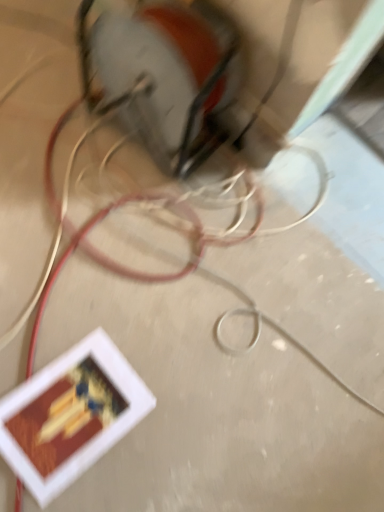
At what (x,y) coordinates should I click in order to perform the action: click on matte red wire at lower left. Please return your answer as a coordinate pair (x, y). Looking at the image, I should click on (121, 264).

What do you see at coordinates (121, 264) in the screenshot? The height and width of the screenshot is (512, 384). I see `matte red wire at lower left` at bounding box center [121, 264].

What is the approximate width of matte red wire at lower left?

The width of matte red wire at lower left is 5.69 feet.

At what (x,y) coordinates should I click in order to perform the action: click on metallic silver power plugs and sockets at upper center. Please return your answer as a coordinate pair (x, y). The height and width of the screenshot is (512, 384). Looking at the image, I should click on (168, 76).

What do you see at coordinates (168, 76) in the screenshot? I see `metallic silver power plugs and sockets at upper center` at bounding box center [168, 76].

This screenshot has width=384, height=512. I want to click on matte red wire at lower left, so click(x=121, y=264).

Between matte red wire at lower left and metallic silver power plugs and sockets at upper center, which one appears on the left side from the viewer's perspective?

metallic silver power plugs and sockets at upper center.

Based on the photo, is the position of matte red wire at lower left more distant than that of metallic silver power plugs and sockets at upper center?

No.

Does point (144, 199) appear closer or farther from the camera than point (178, 119)?

Clearly, point (144, 199) is more distant from the camera than point (178, 119).

From the image's perspective, which is below, matte red wire at lower left or metallic silver power plugs and sockets at upper center?

matte red wire at lower left appears lower in the image.

From a real-world perspective, which object stands above the other?

From a 3D spatial view, metallic silver power plugs and sockets at upper center is above.

Between matte red wire at lower left and metallic silver power plugs and sockets at upper center, which one has smaller width?

Thinner between the two is metallic silver power plugs and sockets at upper center.

Does matte red wire at lower left have a lesser height compared to metallic silver power plugs and sockets at upper center?

Correct, matte red wire at lower left is not as tall as metallic silver power plugs and sockets at upper center.

Who is bigger, matte red wire at lower left or metallic silver power plugs and sockets at upper center?

matte red wire at lower left.

Is matte red wire at lower left located outside metallic silver power plugs and sockets at upper center?

Indeed, matte red wire at lower left is completely outside metallic silver power plugs and sockets at upper center.

Is matte red wire at lower left placed right next to metallic silver power plugs and sockets at upper center?

No, matte red wire at lower left is not in contact with metallic silver power plugs and sockets at upper center.

Looking at this image, is matte red wire at lower left turned away from metallic silver power plugs and sockets at upper center?

No, matte red wire at lower left's orientation is not away from metallic silver power plugs and sockets at upper center.

The width and height of the screenshot is (384, 512). I want to click on power plugs and sockets that is above the matte red wire at lower left (from the image's perspective), so click(x=168, y=76).

Is metallic silver power plugs and sockets at upper center to the left or to the right of matte red wire at lower left in the image?

metallic silver power plugs and sockets at upper center is positioned on matte red wire at lower left's left side.

Is metallic silver power plugs and sockets at upper center positioned in front of matte red wire at lower left?

No, metallic silver power plugs and sockets at upper center is further to the viewer.

Which is further, (205, 37) or (36, 332)?

Positioned behind is point (36, 332).

From the image's perspective, between metallic silver power plugs and sockets at upper center and matte red wire at lower left, who is located below?

From the image's view, matte red wire at lower left is below.

From a real-world perspective, which is physically above, metallic silver power plugs and sockets at upper center or matte red wire at lower left?

metallic silver power plugs and sockets at upper center is physically above.

Is metallic silver power plugs and sockets at upper center thinner than matte red wire at lower left?

Correct, the width of metallic silver power plugs and sockets at upper center is less than that of matte red wire at lower left.

Considering the relative sizes of metallic silver power plugs and sockets at upper center and matte red wire at lower left in the image provided, is metallic silver power plugs and sockets at upper center shorter than matte red wire at lower left?

In fact, metallic silver power plugs and sockets at upper center may be taller than matte red wire at lower left.

In terms of size, does metallic silver power plugs and sockets at upper center appear bigger or smaller than matte red wire at lower left?

metallic silver power plugs and sockets at upper center is smaller than matte red wire at lower left.

Looking at this image, is metallic silver power plugs and sockets at upper center completely or partially outside of matte red wire at lower left?

Yes.

Is metallic silver power plugs and sockets at upper center far away from matte red wire at lower left?

metallic silver power plugs and sockets at upper center is near matte red wire at lower left, not far away.

In the scene shown: Is metallic silver power plugs and sockets at upper center looking in the opposite direction of matte red wire at lower left?

No, metallic silver power plugs and sockets at upper center is not facing away from matte red wire at lower left.

Looking at this image, how different are the orientations of metallic silver power plugs and sockets at upper center and matte red wire at lower left in degrees?

metallic silver power plugs and sockets at upper center and matte red wire at lower left are facing 0.476 degrees away from each other.

Find the location of a particular element. wire beneath the metallic silver power plugs and sockets at upper center (from a real-world perspective) is located at coordinates (121, 264).

What are the coordinates of `wire located in front of the metallic silver power plugs and sockets at upper center` in the screenshot? It's located at (121, 264).

Find the location of a particular element. This screenshot has width=384, height=512. wire that appears below the metallic silver power plugs and sockets at upper center (from a real-world perspective) is located at coordinates [x=121, y=264].